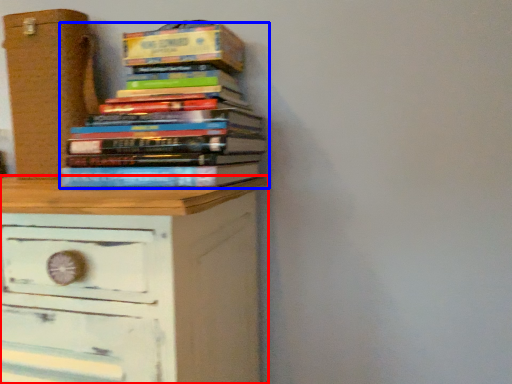
Question: Which object is further to the camera taking this photo, chest of drawers (highlighted by a red box) or book (highlighted by a blue box)?

Choices:
 (A) chest of drawers
 (B) book

Answer: (B)